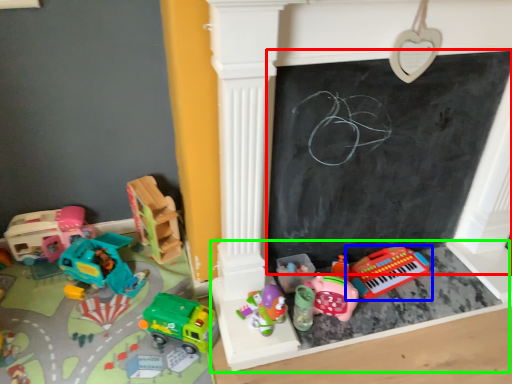
Question: Which object is the farthest from bulletin board (highlighted by a red box)? Choose among these: toy (highlighted by a blue box) or furniture (highlighted by a green box).

Choices:
 (A) toy
 (B) furniture

Answer: (B)